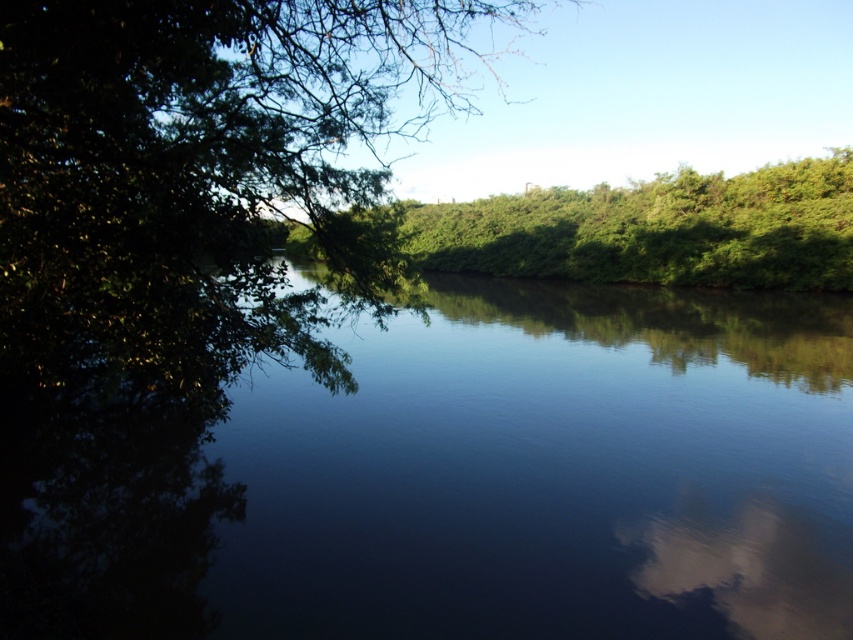
You are a photographer standing in the scene. You want to capture the reflection of the green leafy tree at left in the dark reflective water at center. Is the tree positioned in a way that its reflection would be visible in the water?

The dark reflective water at center is located below green leafy tree at left, so the tree is positioned above the water. Since reflections are typically seen on the water surface when the object is above, the reflection of the green leafy tree at left would be visible in the dark reflective water at center.

You are an observer standing in front of the scene. You see the dark reflective water at center and the green leafy tree at left. Which object is located to the right of the other?

The dark reflective water at center is positioned on the right side of green leafy tree at left.